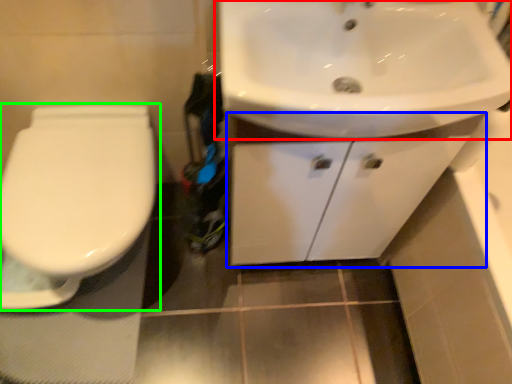
Question: Which is nearer to the sink (highlighted by a red box)? bathroom cabinet (highlighted by a blue box) or toilet (highlighted by a green box).

Choices:
 (A) bathroom cabinet
 (B) toilet

Answer: (A)